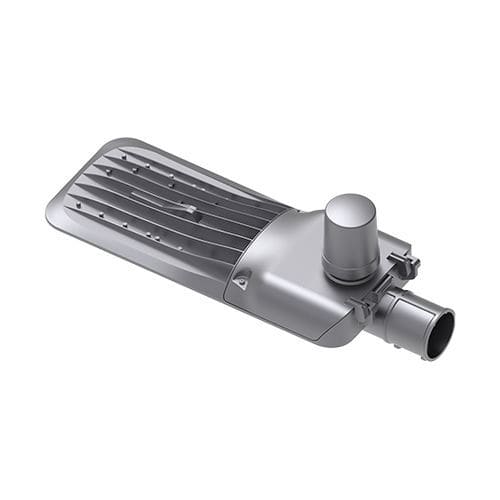
Where is `back of mirror`? The height and width of the screenshot is (500, 500). back of mirror is located at coordinates (282, 258).